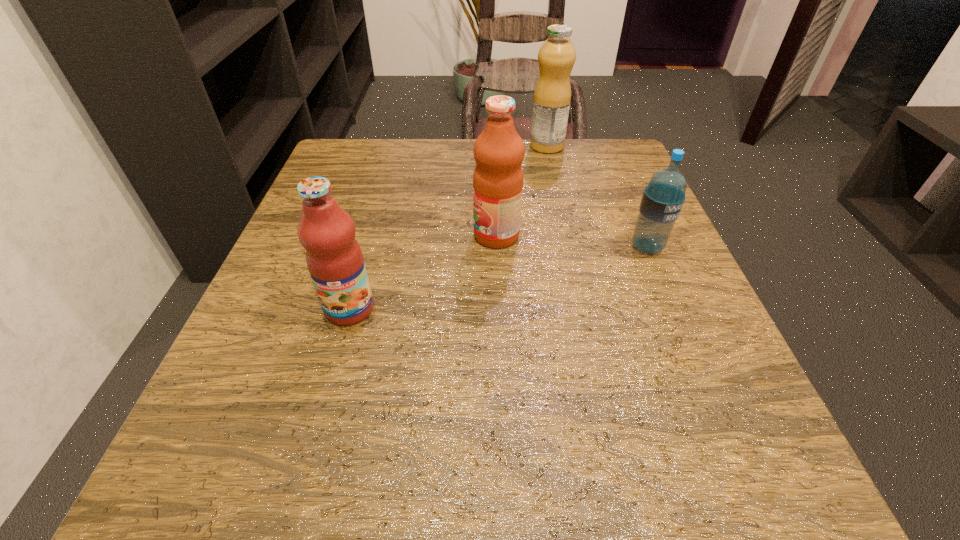
Find the location of a particular element. the farthest object is located at coordinates (552, 96).

I want to click on the farthest fruit juice, so click(552, 96).

Identify the location of the second fruit juice from right to left. (499, 151).

Image resolution: width=960 pixels, height=540 pixels. Identify the location of the third object from right to left. (499, 151).

The width and height of the screenshot is (960, 540). I want to click on the leftmost object, so click(x=334, y=258).

Find the location of `the nearest object`. the nearest object is located at coordinates (334, 258).

The height and width of the screenshot is (540, 960). I want to click on water bottle, so click(x=663, y=198).

Locate an element on the screen. The width and height of the screenshot is (960, 540). the shortest object is located at coordinates (663, 198).

Where is `free region located on the front label of the farthest object`? Image resolution: width=960 pixels, height=540 pixels. free region located on the front label of the farthest object is located at coordinates (464, 146).

You are a GUI agent. You are given a task and a screenshot of the screen. Output one action in this format:
    pyautogui.click(x=<x>, y=<y>)
    Task: Click on the vacant space located 0.080m on the front label of the farthest object
    
    Given the screenshot: What is the action you would take?
    pyautogui.click(x=496, y=146)